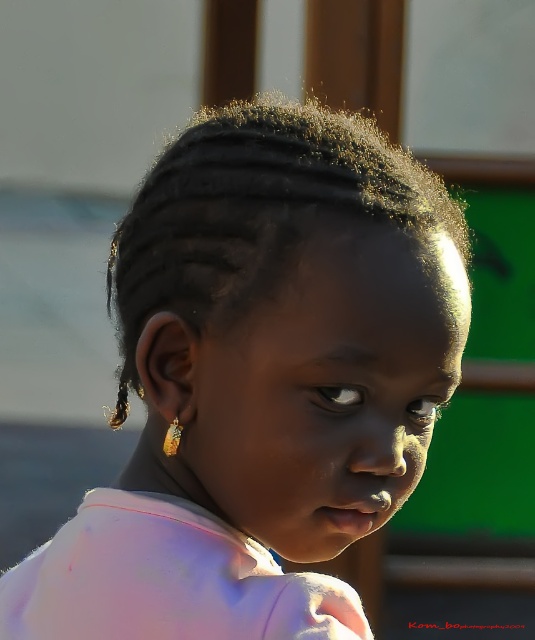
You are a photographer adjusting the focus of your camera. You need to ensure both the dark brown textured hair at center and the black glossy hair at left are in focus. The camera can only focus on objects within a 5 inch range. Can both be in focus?

The distance between the dark brown textured hair at center and the black glossy hair at left is 5.47 inches. Since the camera can only focus within a 5 inch range, the two objects are slightly out of the required range. Therefore, both cannot be in focus simultaneously.

From the picture: Based on the scene description, which object has a greater height between the dark brown textured hair at center and the black glossy hair at left?

The dark brown textured hair at center has a greater height compared to the black glossy hair at left according to the description.

You are a photographer adjusting the lighting for a portrait. You notice the dark brown textured hair at center and the black glossy hair at left. Which hair style is closer to the camera?

The dark brown textured hair at center is closer to the camera because it is in front of the black glossy hair at left.